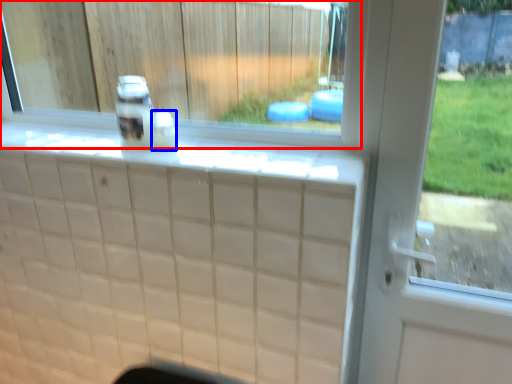
Question: Which point is closer to the camera, window (highlighted by a red box) or bottle (highlighted by a blue box)?

Choices:
 (A) window
 (B) bottle

Answer: (A)